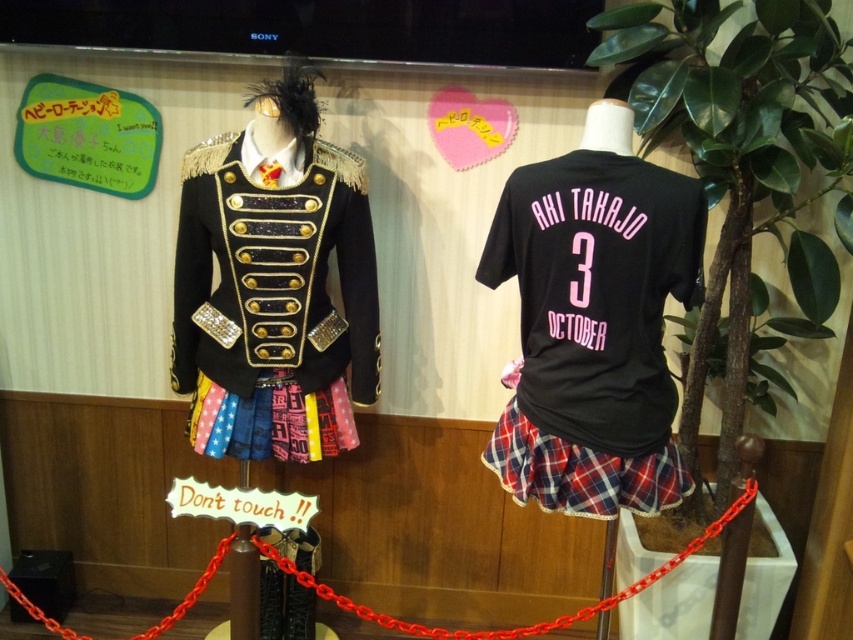
You are a fashion designer observing the mannequins. You need to adjust the display so that the plaid fabric skirt at center is visible above the shiny black jacket at center. Is this possible without moving the skirt or jacket from their current positions?

The shiny black jacket at center is currently above the plaid fabric skirt at center. To have the skirt visible above the jacket without moving them, you would need to rearrange their positions, which isn

You are a customer in a clothing store and see the black jersey at center and the plaid fabric skirt at center displayed in the store. Which item is positioned to the left?

The black jersey at center is positioned to the left of the plaid fabric skirt at center.

You are a customer in a clothing store and see the black jersey at center and the colorful plaid skirt at center displayed in front of you. Which item is closer to you?

The black jersey at center is closer to you because it is in front of the colorful plaid skirt at center.